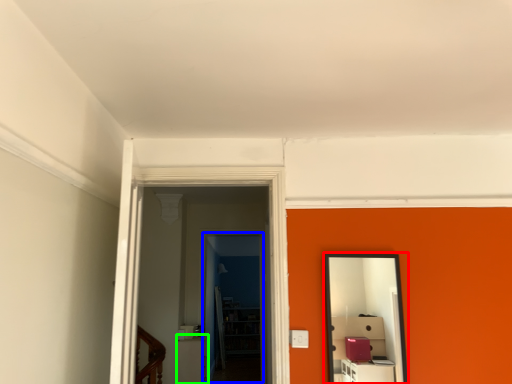
Question: Which object is the closest to the mirror (highlighted by a red box)? Choose among these: glass door (highlighted by a blue box) or furniture (highlighted by a green box).

Choices:
 (A) glass door
 (B) furniture

Answer: (B)